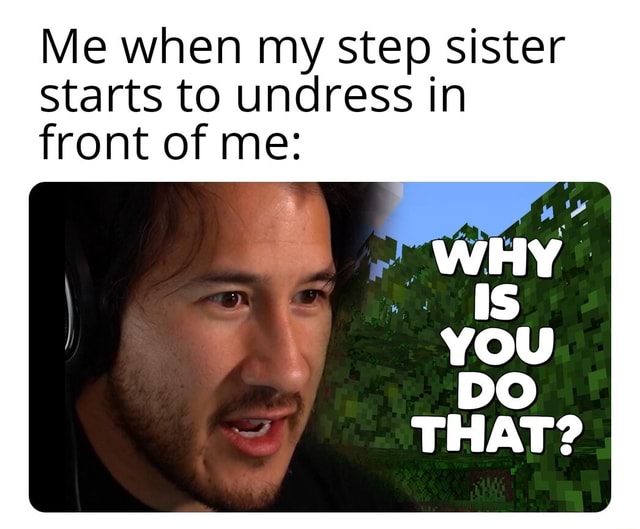
Locate an element on the screen. The width and height of the screenshot is (640, 529). head phones is located at coordinates (70, 299).